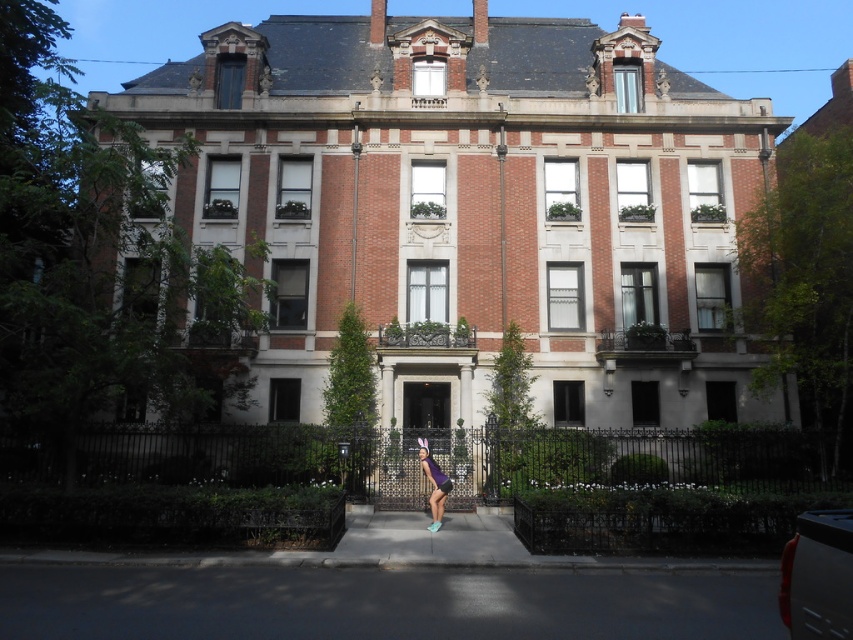
Based on the photo, you are a guest at a garden party and see the purple fabric shorts at center and the transparent plastic umbrella at center. Which object is taller?

The purple fabric shorts at center is much taller than the transparent plastic umbrella at center.

You are a delivery person holding a large package that is 1.2 meters in length. You need to place it between the purple fabric shorts at center and the transparent plastic umbrella at center. Considering their sizes, will the package fit in the space between them?

The purple fabric shorts at center has a larger size compared to transparent plastic umbrella at center. Since the package is 1.2 meters long, it depends on the actual distance between them. However, the description only mentions their relative sizes, not the exact distance. Without knowing the exact space between them, we cannot determine if the package will fit.

You are standing in the garden of the grand building and want to walk towards the entrance. There are two points marked on the path in front of you at coordinates point (427, 474) and point (416, 436). Which point should you step on first to reach the entrance?

You should step on point (427, 474) first because it is in front of point (416, 436), meaning it is closer to the entrance.